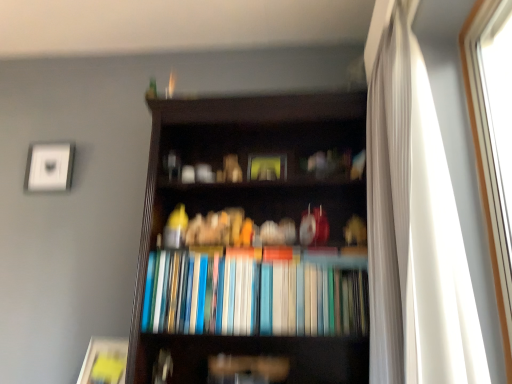
Question: From a real-world perspective, does white glass window at right stand above matte yellow paperback book at lower left?

Choices:
 (A) yes
 (B) no

Answer: (A)

Question: Considering the relative sizes of white glass window at right and matte yellow paperback book at lower left in the image provided, is white glass window at right smaller than matte yellow paperback book at lower left?

Choices:
 (A) yes
 (B) no

Answer: (B)

Question: Considering the relative sizes of white glass window at right and matte yellow paperback book at lower left in the image provided, is white glass window at right wider than matte yellow paperback book at lower left?

Choices:
 (A) yes
 (B) no

Answer: (B)

Question: Considering the relative sizes of white glass window at right and matte yellow paperback book at lower left in the image provided, is white glass window at right shorter than matte yellow paperback book at lower left?

Choices:
 (A) no
 (B) yes

Answer: (A)

Question: Is white glass window at right far from matte yellow paperback book at lower left?

Choices:
 (A) no
 (B) yes

Answer: (B)

Question: Does white glass window at right appear on the right side of matte yellow paperback book at lower left?

Choices:
 (A) no
 (B) yes

Answer: (B)

Question: Can you confirm if white glass window at right is bigger than hardcover books at center?

Choices:
 (A) no
 (B) yes

Answer: (A)

Question: Can you confirm if white glass window at right is shorter than hardcover books at center?

Choices:
 (A) yes
 (B) no

Answer: (B)

Question: From the image's perspective, is white glass window at right beneath hardcover books at center?

Choices:
 (A) no
 (B) yes

Answer: (A)

Question: Is white glass window at right turned away from hardcover books at center?

Choices:
 (A) yes
 (B) no

Answer: (B)

Question: Is white glass window at right oriented towards hardcover books at center?

Choices:
 (A) yes
 (B) no

Answer: (B)

Question: Does white glass window at right lie behind hardcover books at center?

Choices:
 (A) no
 (B) yes

Answer: (A)

Question: Is matte yellow paperback book at lower left oriented away from white glass window at right?

Choices:
 (A) yes
 (B) no

Answer: (B)